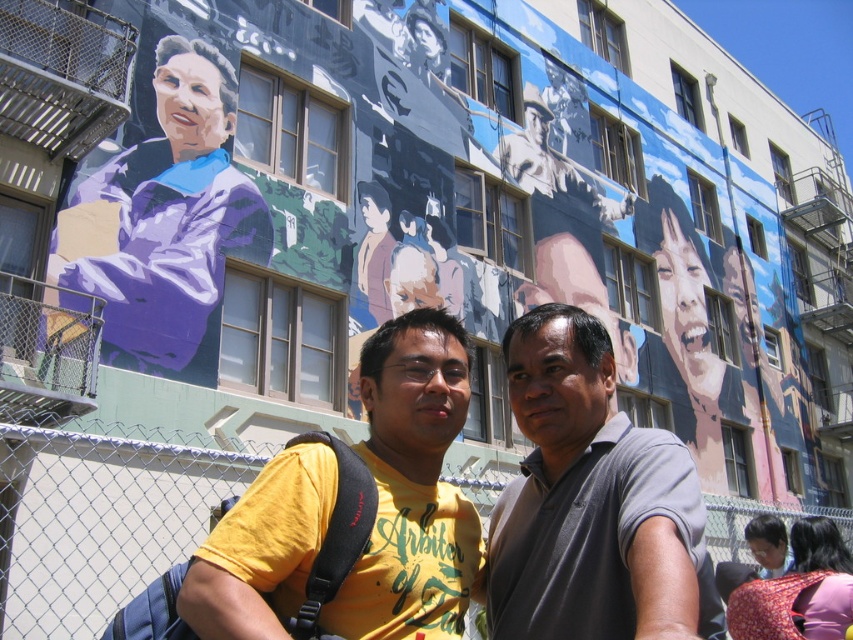
Question: Which point is farther to the camera?

Choices:
 (A) red floral dress at lower right
 (B) yellow matte t-shirt at center
 (C) smooth black hair at lower right
 (D) white chain-link fence at lower left

Answer: (C)

Question: Is the position of yellow matte t-shirt at center less distant than that of smooth black hair at lower right?

Choices:
 (A) yes
 (B) no

Answer: (A)

Question: Is gray matte shirt at center further to camera compared to white chain-link fence at lower left?

Choices:
 (A) yes
 (B) no

Answer: (B)

Question: Based on their relative distances, which object is farther from the gray matte shirt at center?

Choices:
 (A) purple glossy jacket at upper left
 (B) smooth black hair at lower right
 (C) white chain-link fence at lower left
 (D) yellow matte t-shirt at center

Answer: (A)

Question: Does white chain-link fence at lower left have a smaller size compared to red floral dress at lower right?

Choices:
 (A) no
 (B) yes

Answer: (A)

Question: Estimate the real-world distances between objects in this image. Which object is closer to the smooth black hair at lower right?

Choices:
 (A) white chain-link fence at lower left
 (B) red floral dress at lower right
 (C) yellow matte t-shirt at center

Answer: (B)